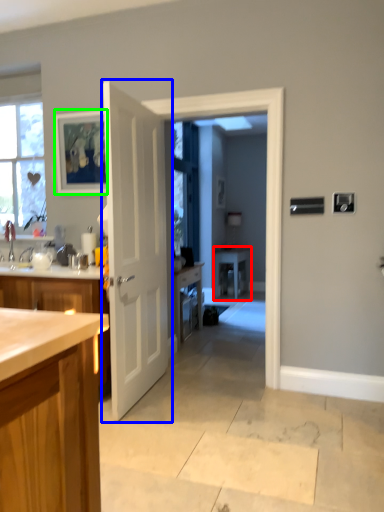
Question: Which is nearer to the table (highlighted by a red box)? door (highlighted by a blue box) or picture frame (highlighted by a green box).

Choices:
 (A) door
 (B) picture frame

Answer: (B)